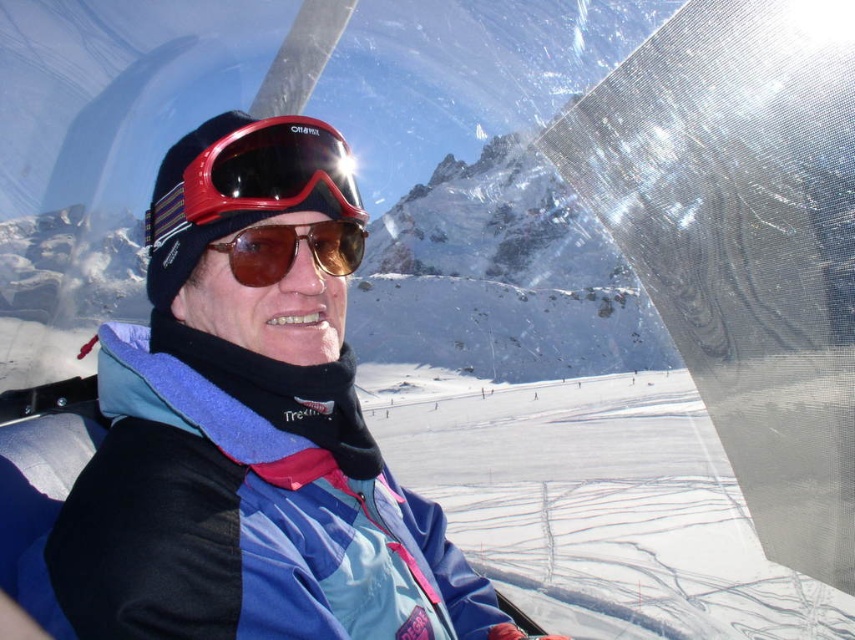
Question: Is matte black jacket at center to the right of glossy red ski goggles at center from the viewer's perspective?

Choices:
 (A) yes
 (B) no

Answer: (A)

Question: Which of the following is the farthest from the observer?

Choices:
 (A) glossy red ski goggles at center
 (B) matte black jacket at center
 (C) brown reflective sunglasses at center

Answer: (C)

Question: Which object appears farthest from the camera in this image?

Choices:
 (A) glossy red ski goggles at center
 (B) brown reflective sunglasses at center

Answer: (B)

Question: Is matte black jacket at center positioned at the back of glossy red ski goggles at center?

Choices:
 (A) no
 (B) yes

Answer: (A)

Question: Which point is closer to the camera?

Choices:
 (A) glossy red ski goggles at center
 (B) matte black jacket at center

Answer: (B)

Question: Is matte black jacket at center behind glossy red ski goggles at center?

Choices:
 (A) no
 (B) yes

Answer: (A)